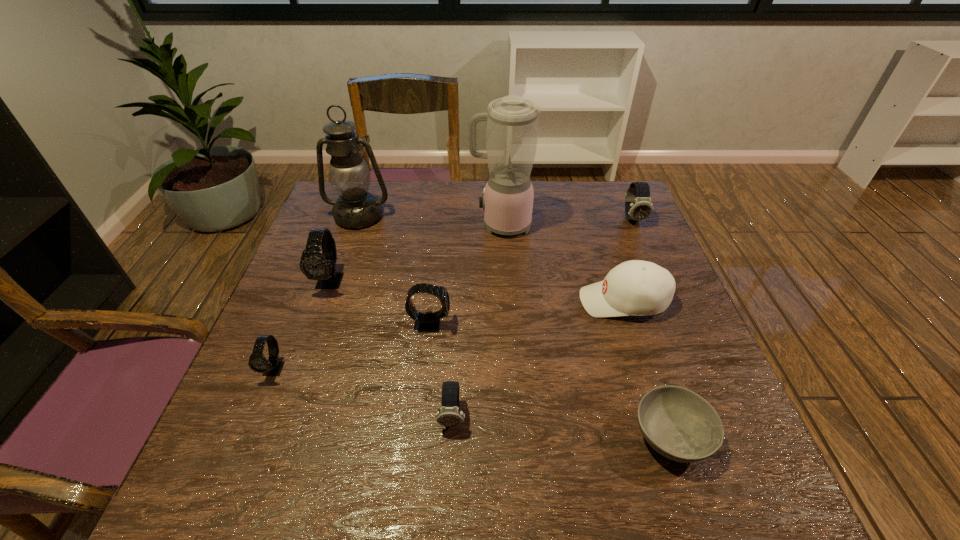
This screenshot has height=540, width=960. In order to click on vacant region that satisfies the following two spatial constraints: 1. on the base of the food processor near the control knob; 2. on the face of the third nearest object in this screenshot , I will do `click(510, 369)`.

The height and width of the screenshot is (540, 960). What are the coordinates of `vacant space that satisfies the following two spatial constraints: 1. on the base of the food processor near the control knob; 2. on the back side of the bowl` in the screenshot? It's located at (514, 435).

You are a GUI agent. You are given a task and a screenshot of the screen. Output one action in this format:
    pyautogui.click(x=<x>, y=<y>)
    Task: Click on the free space that satisfies the following two spatial constraints: 1. on the face of the bowl; 2. on the left side of the farthest gray watch
    Image resolution: width=960 pixels, height=540 pixels.
    Given the screenshot: What is the action you would take?
    pyautogui.click(x=276, y=435)

Locate an element on the screen. Image resolution: width=960 pixels, height=540 pixels. vacant space that satisfies the following two spatial constraints: 1. on the base of the food processor near the control knob; 2. on the face of the fourth farthest watch is located at coordinates (510, 369).